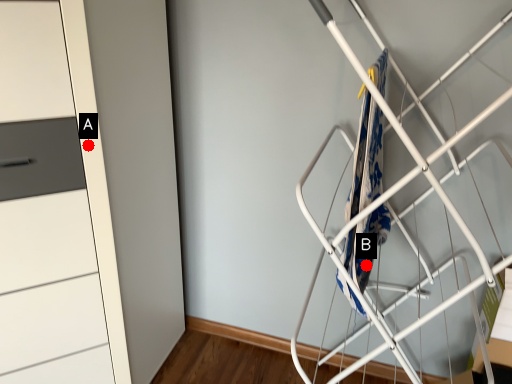
Question: Two points are circled on the image, labeled by A and B beside each circle. Which point is closer to the camera?

Choices:
 (A) A is closer
 (B) B is closer

Answer: (A)